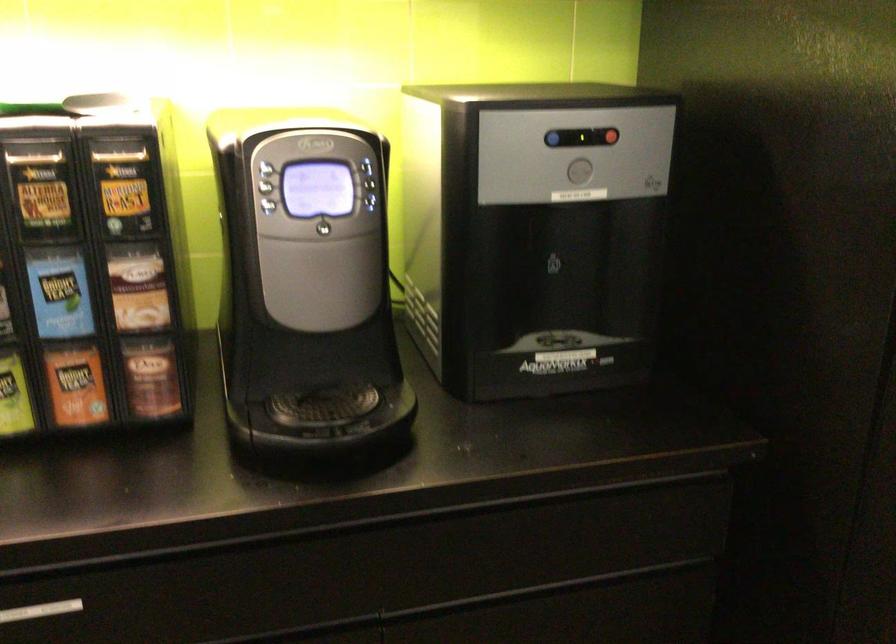
The height and width of the screenshot is (644, 896). Describe the element at coordinates (40, 611) in the screenshot. I see `the silver drawer handle` at that location.